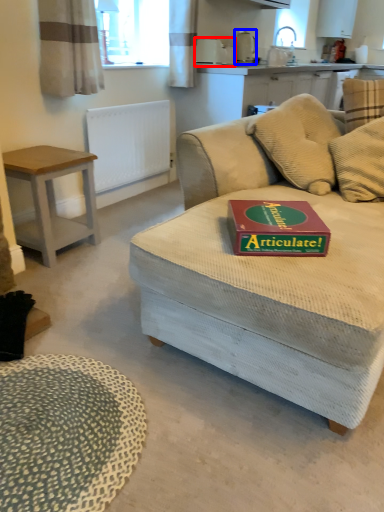
Question: Which of the following is the closest to the observer, appliance (highlighted by a red box) or appliance (highlighted by a blue box)?

Choices:
 (A) appliance
 (B) appliance

Answer: (A)